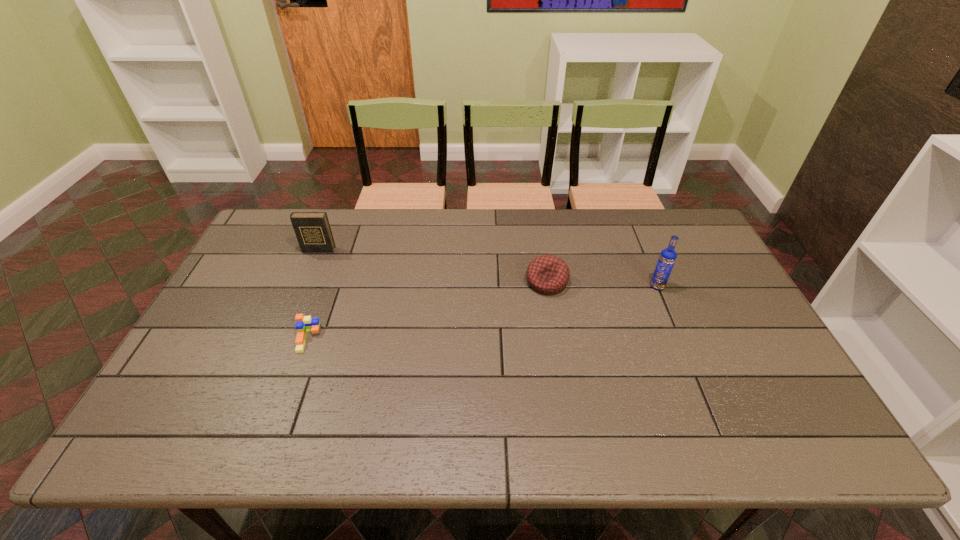
The width and height of the screenshot is (960, 540). Identify the location of vacant region located 0.380m on the right of the second shortest object. (693, 282).

You are a GUI agent. You are given a task and a screenshot of the screen. Output one action in this format:
    pyautogui.click(x=<x>, y=<y>)
    Task: Click on the blank space located 0.120m on the right of the Lego
    This screenshot has width=960, height=540.
    Given the screenshot: What is the action you would take?
    pyautogui.click(x=364, y=339)

Locate an element on the screen. object that is positioned at the far edge is located at coordinates (312, 229).

You are a GUI agent. You are given a task and a screenshot of the screen. Output one action in this format:
    pyautogui.click(x=<x>, y=<y>)
    Task: Click on the vacant region at the far edge of the desktop
    
    Given the screenshot: What is the action you would take?
    pyautogui.click(x=649, y=245)

At what (x,y) coordinates should I click in order to perform the action: click on free space at the near edge of the desktop. Please return your answer as a coordinate pair (x, y). This screenshot has width=960, height=540. Looking at the image, I should click on (374, 432).

Image resolution: width=960 pixels, height=540 pixels. I want to click on blank space at the left edge, so click(x=266, y=318).

Identify the location of vacant area that lies between the beanbag and the nearest object. This screenshot has height=540, width=960. (427, 310).

Image resolution: width=960 pixels, height=540 pixels. What are the coordinates of `vacant space in between the shortest object and the second tallest object` in the screenshot? It's located at (313, 294).

This screenshot has width=960, height=540. Identify the location of vacant area that lies between the Lego and the third object from left to right. (427, 310).

This screenshot has width=960, height=540. I want to click on free space between the farthest object and the rightmost object, so click(488, 268).